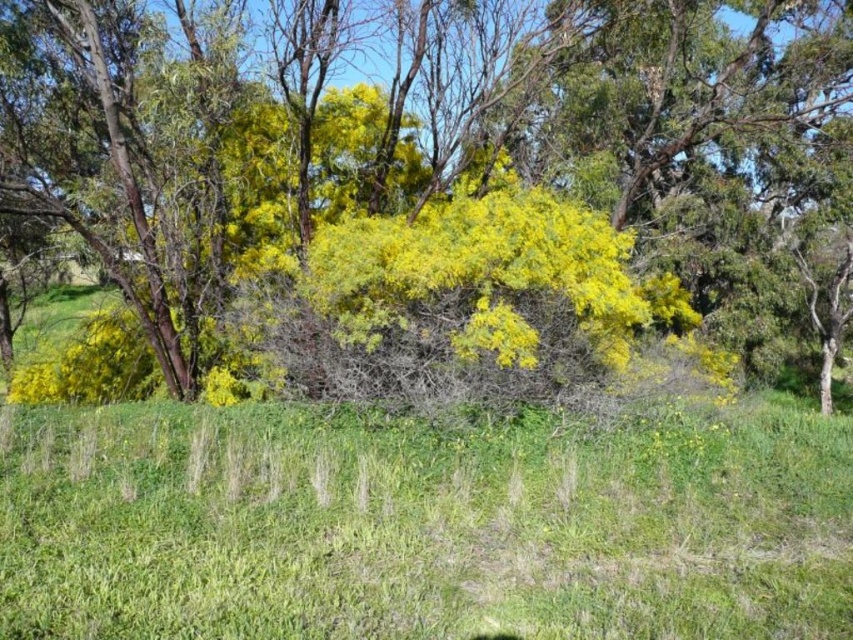
You are standing at the camera position and want to know how far you are from the point marked at coordinates (125,134). Can you determine the distance?

The distance of point (125,134) from camera is 29.98 feet.